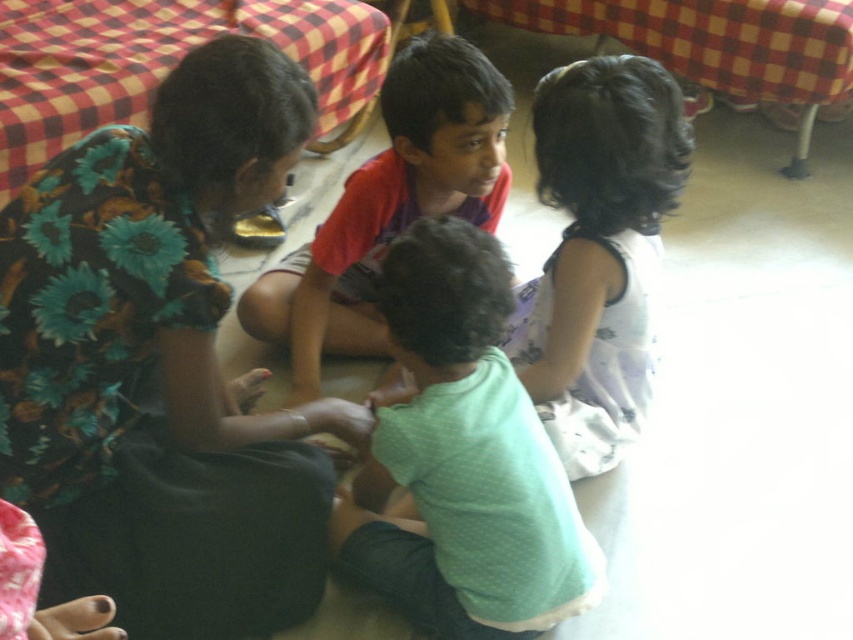
You are a photographer trying to capture a group photo of the children. Since the floral fabric dress at upper left and the red shirt at center are the main focuses, which child should you zoom in on to ensure both are clearly visible without cropping?

You should zoom in on the red shirt at center because the floral fabric dress at upper left has a lesser width, making it smaller and easier to fit within the frame when focusing on the larger red shirt at center.

You are a photographer trying to capture a closeup of the child in the red shirt and dark shorts. You are currently positioned at point (251, 372). If you move towards point (598, 208), will you get closer to the child in the red shirt and dark shorts?

Moving from point (251, 372) to point (598, 208) will take you further away from the child in the red shirt and dark shorts because point (251, 372) is closer to the child than point (598, 208).

In the scene shown: You are a photographer taking a picture of the children. You want to ensure both the floral fabric dress at upper left and the red shirt at center are clearly visible in the frame. Which child should you position closer to the center of the image to achieve this?

You should position the red shirt at center closer to the center of the image since it is already at center, while the floral fabric dress at upper left is to the left of it. This ensures both are visible.